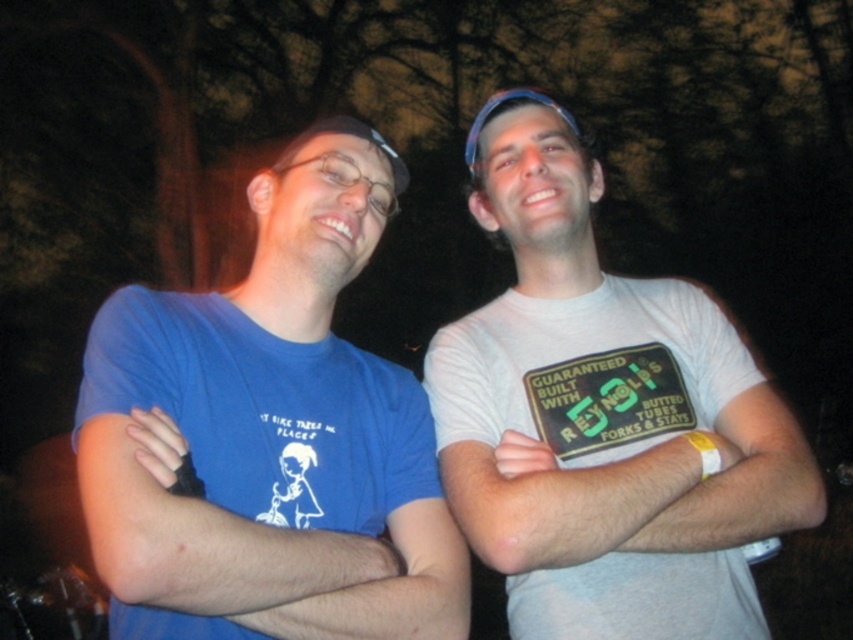
Question: Where is matte blue t-shirt at left located in relation to white cotton t-shirt at center in the image?

Choices:
 (A) below
 (B) above

Answer: (A)

Question: Can you confirm if matte blue t-shirt at left is positioned to the left of white cotton t-shirt at center?

Choices:
 (A) yes
 (B) no

Answer: (A)

Question: Which point is farther from the camera taking this photo?

Choices:
 (A) (302, 636)
 (B) (521, 289)

Answer: (B)

Question: Which object is farther from the camera taking this photo?

Choices:
 (A) white cotton t-shirt at center
 (B) matte blue t-shirt at left

Answer: (A)

Question: Does matte blue t-shirt at left appear on the left side of white cotton t-shirt at center?

Choices:
 (A) no
 (B) yes

Answer: (B)